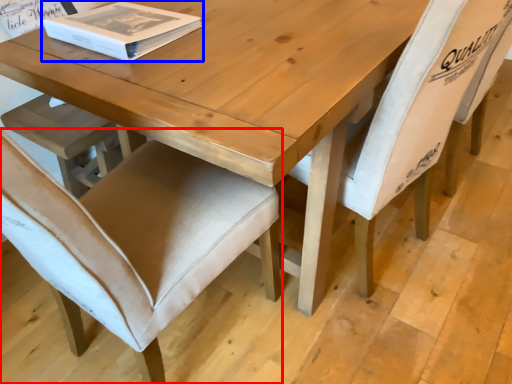
Question: Which point is further to the camera, chair (highlighted by a red box) or box (highlighted by a blue box)?

Choices:
 (A) chair
 (B) box

Answer: (B)